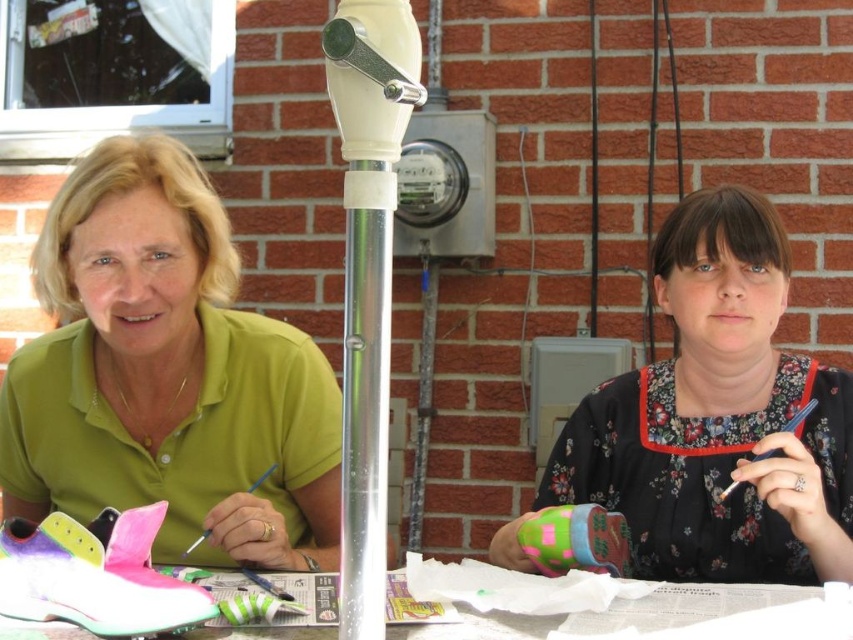
Is green matte shirt at center below floral fabric dress at center?

Indeed, green matte shirt at center is positioned under floral fabric dress at center.

Describe the element at coordinates (166, 374) in the screenshot. The width and height of the screenshot is (853, 640). I see `green matte shirt at center` at that location.

Where is `green matte shirt at center`? This screenshot has width=853, height=640. green matte shirt at center is located at coordinates (166, 374).

Which is behind, point (142, 451) or point (479, 572)?

Positioned behind is point (142, 451).

Which is behind, point (44, 464) or point (735, 584)?

The point (44, 464) is behind.

Locate an element on the screen. This screenshot has height=640, width=853. green matte shirt at center is located at coordinates (166, 374).

Which is below, floral fabric dress at center or white paper at center?

white paper at center is lower down.

Is floral fabric dress at center to the right of white paper at center from the viewer's perspective?

Indeed, floral fabric dress at center is positioned on the right side of white paper at center.

The height and width of the screenshot is (640, 853). Identify the location of floral fabric dress at center. pos(718,417).